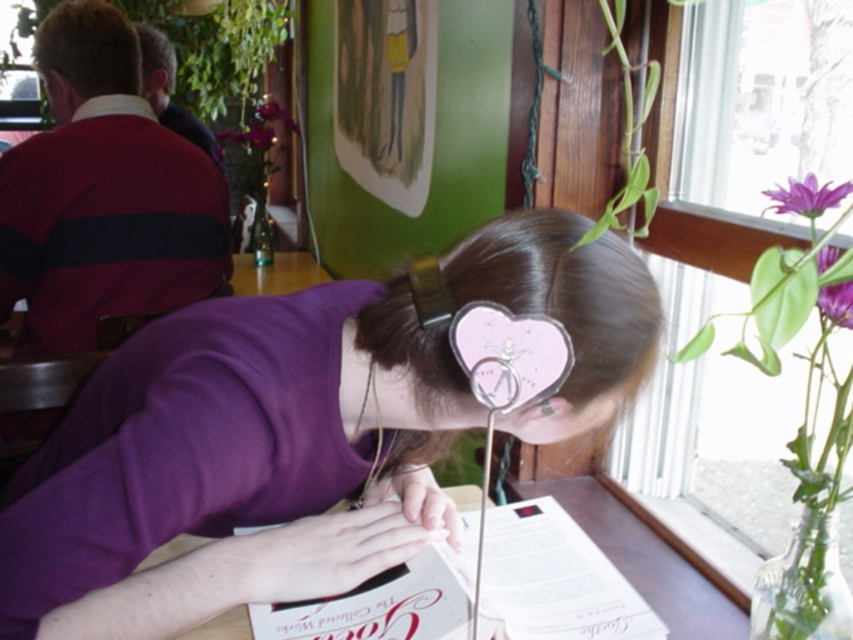
You are a customer at the cafe and want to order a drink. You see the white paper menu at lower center and the matte pink paper at center on the table. Which one is taller?

The white paper menu at lower center is taller than the matte pink paper at center.

You are standing at the entrance of the cafe and want to find the person wearing the purple matte shirt at center. According to the coordinates given, in which direction should you look to locate them?

The purple matte shirt at center is located at coordinates point [234,461], so you should look towards the lower right direction to locate them.

You are designing a layout for a magazine cover. The magazine must feature both the purple matte shirt at center and the purple matte flower at upper right. Based on the scene described, which object should be placed first in terms of size to maintain visual hierarchy?

The purple matte shirt at center should be placed first because it is bigger than the purple matte flower at upper right, ensuring the larger object holds more visual weight as per the scene.